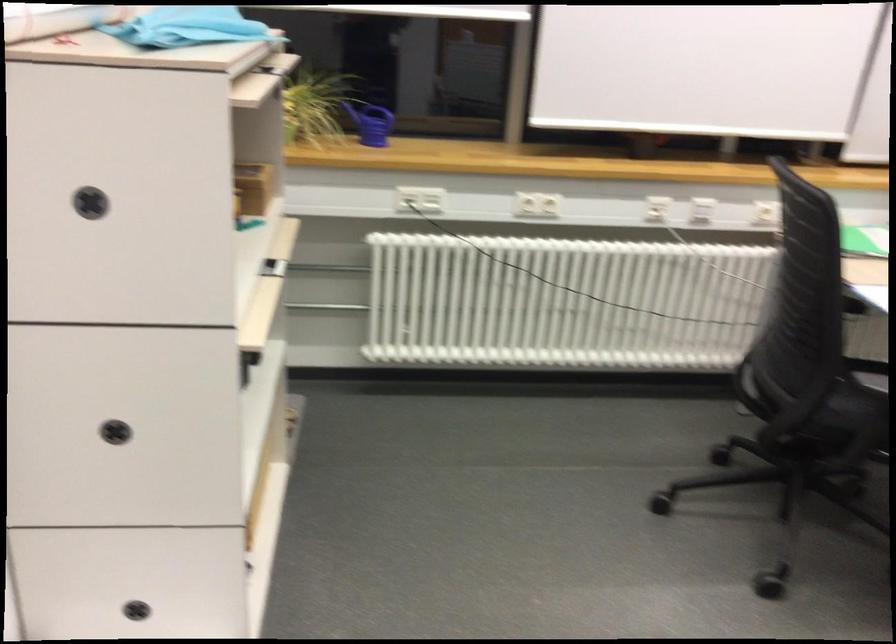
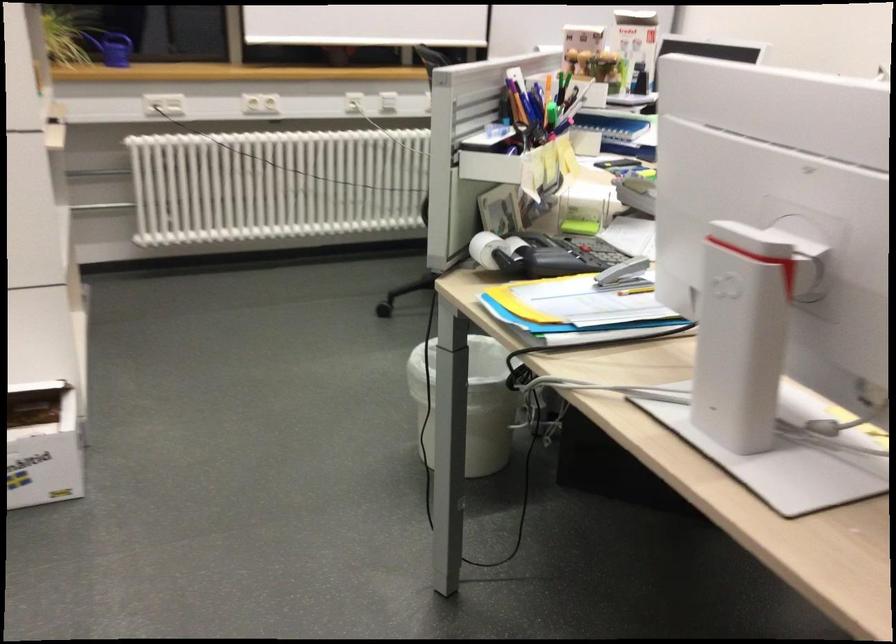
Locate, in the second image, the point that corresponds to (367,126) in the first image.

(112, 48)